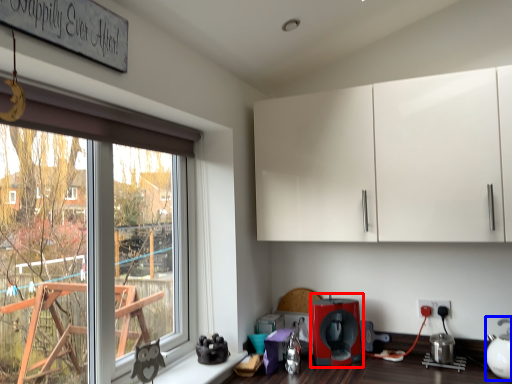
Question: Which object is closer to the camera taking this photo, coffee machine (highlighted by a red box) or tea pot (highlighted by a blue box)?

Choices:
 (A) coffee machine
 (B) tea pot

Answer: (B)